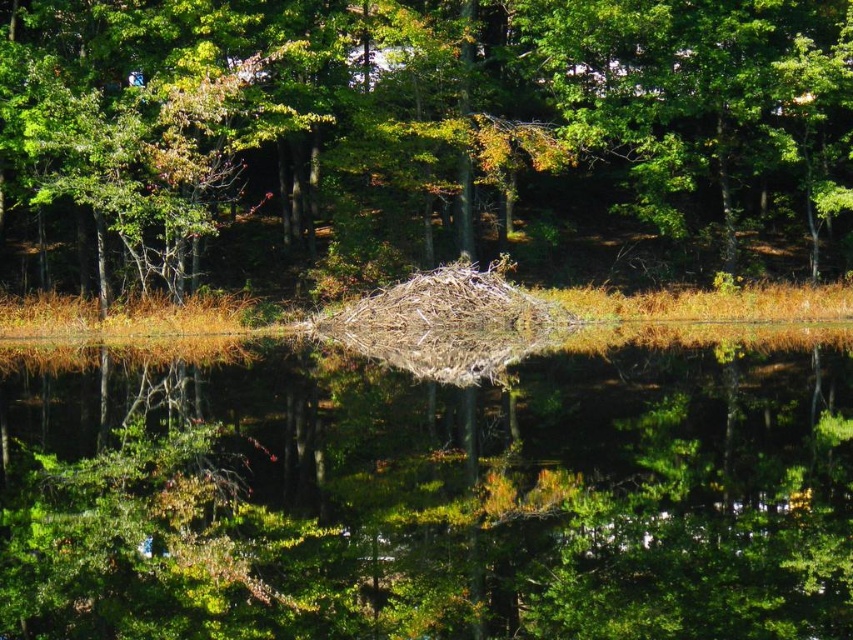
You are an ornithologist observing the scene. You notice a brown textured nest at center and a brown textured water at center. Which object is positioned more to the left?

The brown textured nest at center is positioned to the left of the brown textured water at center.

You are a bird flying over the serene natural scene. You see a brown textured nest at center and a brown textured water at center. Which object is positioned higher from the ground?

The brown textured nest at center is located above brown textured water at center, so the nest is higher from the ground than the water.